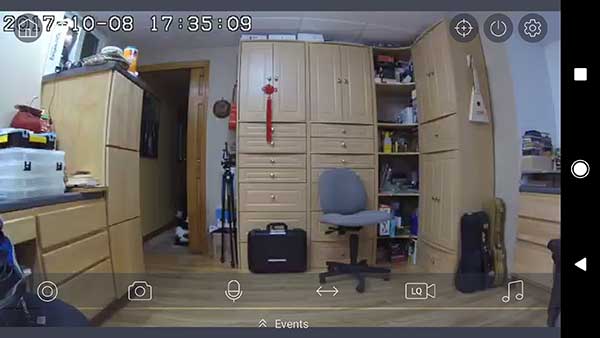
Where is `gray chair`? The height and width of the screenshot is (338, 600). gray chair is located at coordinates (346, 204).